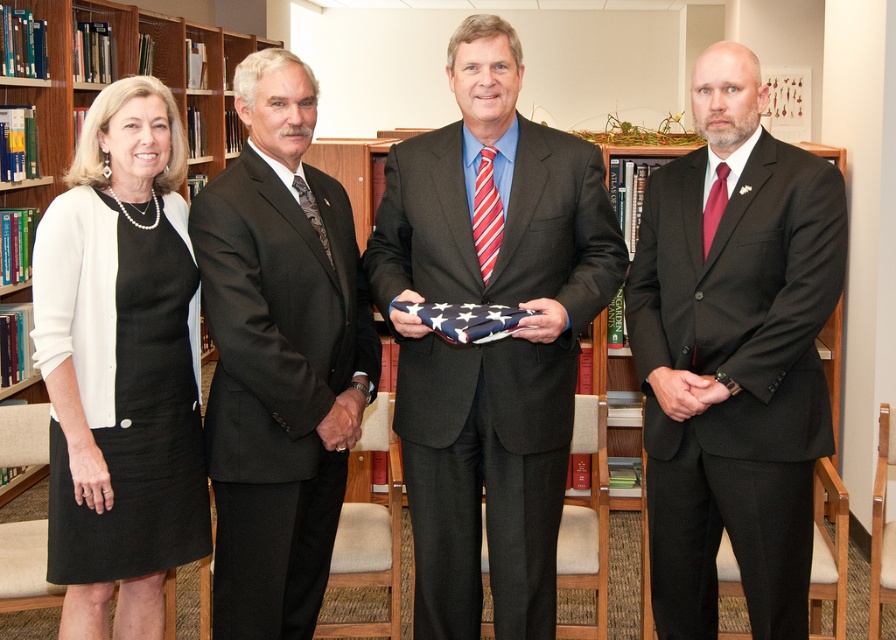
You are organizing a formal event and need to arrange seating based on the attire width. The attendees are wearing a matte black suit at right and a white matte dress at left. Which attendee should you seat first if wider attire requires more space?

The matte black suit at right has a greater width than the white matte dress at left, so you should seat the attendee wearing the matte black suit at right first to accommodate their wider attire.

You are a photographer standing in the center of the room. You need to take a photo that includes both the matte black suit at right and the white matte dress at left. What is the minimum distance you should position yourself from the closest object to ensure both are in frame?

The minimum distance you should position yourself from the closest object, the white matte dress at left, is 0.765 meters. This ensures both the matte black suit at right and the white matte dress at left, which are 1.53 meters apart, are within the camera frame.

Consider the image. You are a photographer setting up for a group photo. You need to adjust the background so that the black suit at center is visible in front of the matte black suit at right. Is this possible based on their current positions?

The black suit at center is currently behind the matte black suit at right, so adjusting the background to make the black suit at center visible in front would not be possible without moving the individuals.